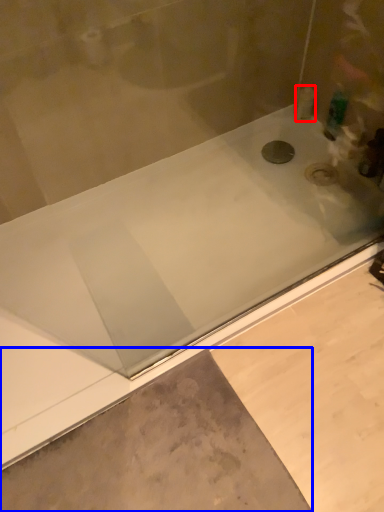
Question: Among these objects, which one is farthest to the camera, toiletry (highlighted by a red box) or concrete (highlighted by a blue box)?

Choices:
 (A) toiletry
 (B) concrete

Answer: (A)